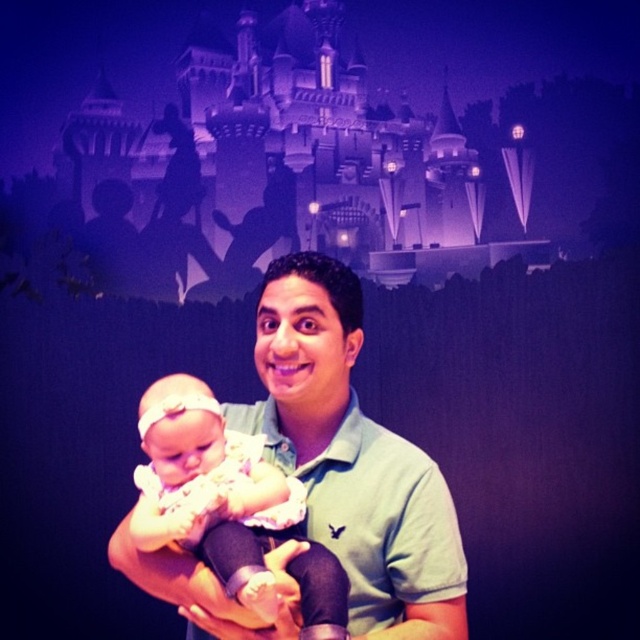
Question: Among these points, which one is nearest to the camera?

Choices:
 (A) (170, 253)
 (B) (349, 385)
 (C) (214, 508)

Answer: (C)

Question: Which point is closer to the camera taking this photo?

Choices:
 (A) (184, 54)
 (B) (260, 468)
 (C) (317, 380)

Answer: (B)

Question: Observing the image, what is the correct spatial positioning of purple stone castle at upper center in reference to green cotton shirt at center?

Choices:
 (A) right
 (B) left

Answer: (B)

Question: Can you confirm if purple stone castle at upper center is positioned to the right of green cotton shirt at center?

Choices:
 (A) no
 (B) yes

Answer: (A)

Question: Can you confirm if green cotton shirt at center is positioned to the left of soft pink fabric baby at center?

Choices:
 (A) yes
 (B) no

Answer: (B)

Question: Which object is positioned closest to the purple stone castle at upper center?

Choices:
 (A) green cotton shirt at center
 (B) soft pink fabric baby at center

Answer: (A)